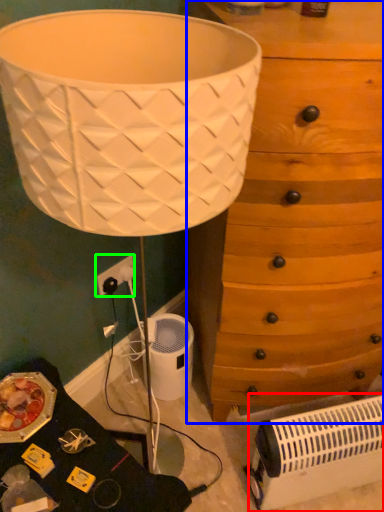
Question: Considering the real-world distances, which object is farthest from heater (highlighted by a red box)? chest of drawers (highlighted by a blue box) or electric outlet (highlighted by a green box)?

Choices:
 (A) chest of drawers
 (B) electric outlet

Answer: (B)